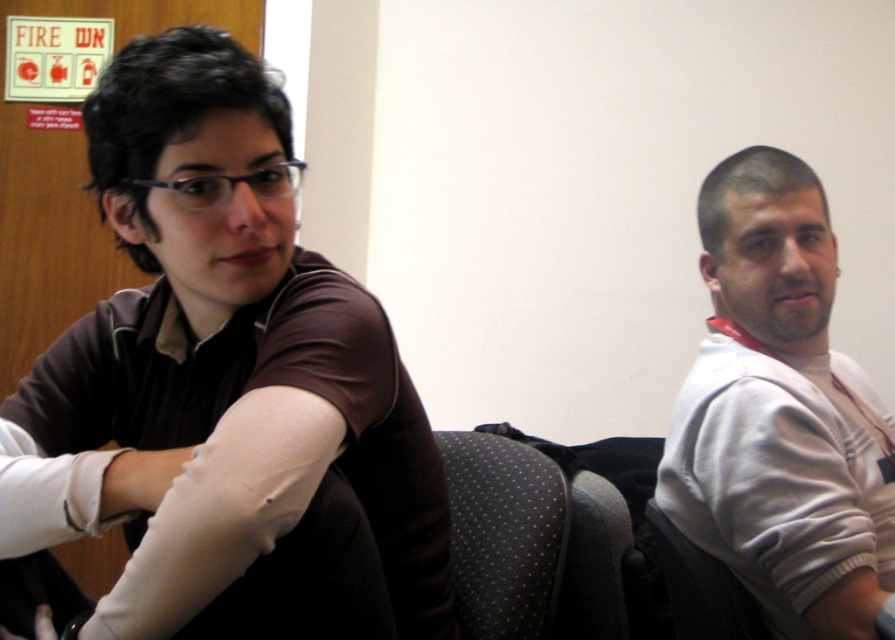
You are a photographer setting up a shoot in this room. You have a camera that can only focus on objects taller than 1 meter. The white fleece jacket at right and dark fabric armchair at center are in your frame. Which object will the camera focus on?

The white fleece jacket at right has a greater height compared to the dark fabric armchair at center, so the camera will focus on the white fleece jacket at right since it is taller than 1 meter.

You are a photographer setting up for a group photo. You notice the white fleece jacket at right and the dark fabric armchair at center. Which object is positioned higher in the image?

The white fleece jacket at right is located above the dark fabric armchair at center, so it is positioned higher in the image.

You are a photographer setting up for a group photo. You need to place two props, a dark fabric armchair at center and a white matte bandage at lower left, in a way that aligns with their current positions. Which prop should be placed to the right of the other?

The dark fabric armchair at center should be placed to the right of the white matte bandage at lower left because the dark fabric armchair at center is positioned on the right side of white matte bandage at lower left.